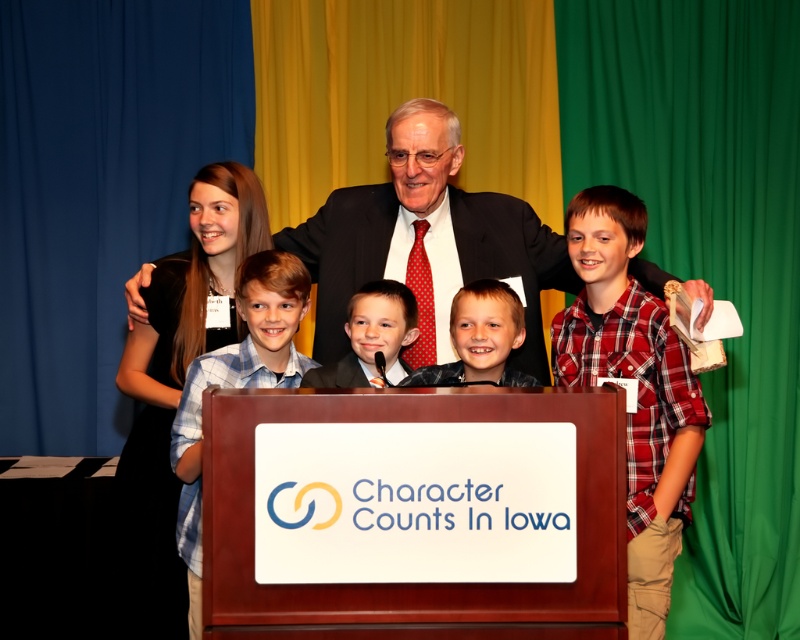
Between blue plaid shirt at center and smooth black suit at center, which one is positioned higher?

smooth black suit at center is higher up.

Based on the photo, is blue plaid shirt at center closer to camera compared to smooth black suit at center?

Yes, it is in front of smooth black suit at center.

Does point (182, 502) lie in front of point (381, 328)?

Yes, it is in front of point (381, 328).

You are a GUI agent. You are given a task and a screenshot of the screen. Output one action in this format:
    pyautogui.click(x=<x>, y=<y>)
    Task: Click on the blue plaid shirt at center
    This screenshot has height=640, width=800.
    Given the screenshot: What is the action you would take?
    pyautogui.click(x=237, y=384)

This screenshot has width=800, height=640. What do you see at coordinates (424, 236) in the screenshot?
I see `black suit at center` at bounding box center [424, 236].

Is the position of black suit at center more distant than that of red plaid shirt at right?

Yes, black suit at center is further from the viewer.

Which is behind, point (360, 211) or point (656, 572)?

Positioned behind is point (360, 211).

Identify the location of black suit at center. Image resolution: width=800 pixels, height=640 pixels. (424, 236).

Can you confirm if red plaid shirt at right is positioned above light brown hair at center?

No.

Can you confirm if red plaid shirt at right is positioned to the right of light brown hair at center?

Yes, red plaid shirt at right is to the right of light brown hair at center.

Does point (628, 541) lie in front of point (496, 282)?

That is True.

Where is `red plaid shirt at right`? Image resolution: width=800 pixels, height=640 pixels. red plaid shirt at right is located at coordinates (636, 387).